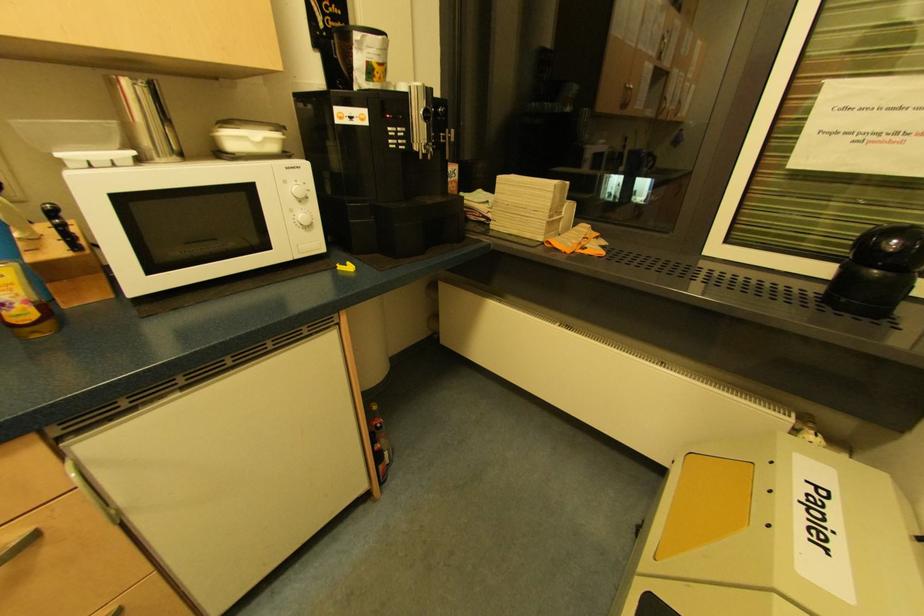
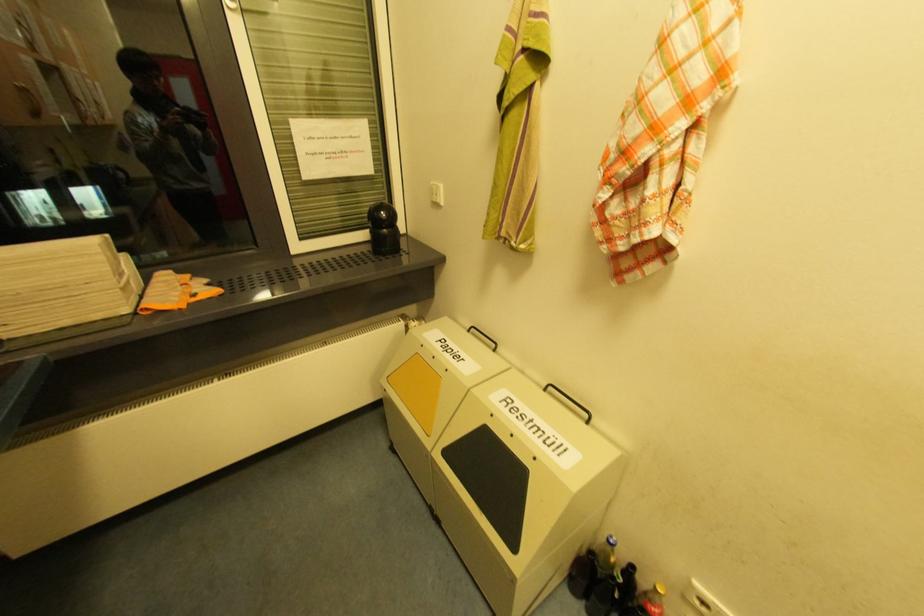
Locate, in the second image, the point that corresponds to [879,272] in the first image.

(388, 230)